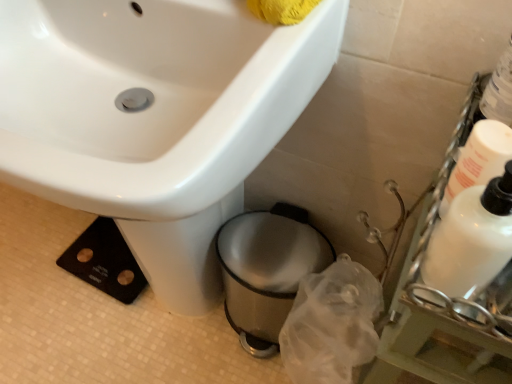
Locate an element on the screen. white glossy bottle at right, the 1th cleaning product when ordered from left to right is located at coordinates (471, 239).

In order to face shiny metallic trash can at lower center, should I rotate leftwards or rightwards?

Rotate right and turn 3.089 degrees.

What is the approximate width of shiny metallic trash can at lower center?

shiny metallic trash can at lower center is 10.18 inches wide.

I want to click on white glossy bottle at right, the 1th cleaning product when ordered from right to left, so click(479, 159).

You are a GUI agent. You are given a task and a screenshot of the screen. Output one action in this format:
    pyautogui.click(x=<x>, y=<y>)
    Task: Click on the white glossy bottle at right, the 1th cleaning product when ordered from left to right
    The image size is (512, 384).
    Given the screenshot: What is the action you would take?
    pyautogui.click(x=471, y=239)

Between white glossy bottle at right, the second cleaning product viewed from the left, and white glossy bottle at right, the 1th cleaning product when ordered from left to right, which one has more height?

With more height is white glossy bottle at right, the 1th cleaning product when ordered from left to right.

From a real-world perspective, is white glossy bottle at right, the 1th cleaning product when ordered from right to left, over white glossy bottle at right, the 1th cleaning product when ordered from left to right?

No.

Considering the positions of objects white glossy bottle at right, the second cleaning product viewed from the left, and white glossy bottle at right, acting as the 2th cleaning product starting from the right, in the image provided, who is behind, white glossy bottle at right, the second cleaning product viewed from the left, or white glossy bottle at right, acting as the 2th cleaning product starting from the right,?

Positioned behind is white glossy bottle at right, the second cleaning product viewed from the left.

Which is in front, point (447, 199) or point (470, 243)?

Positioned in front is point (470, 243).

What's the angular difference between white glossy bottle at right, acting as the 2th cleaning product starting from the right, and shiny metallic trash can at lower center's facing directions?

They differ by 95.4 degrees in their facing directions.

From the picture: Is white glossy bottle at right, acting as the 2th cleaning product starting from the right, not inside shiny metallic trash can at lower center?

Yes, white glossy bottle at right, acting as the 2th cleaning product starting from the right, is outside of shiny metallic trash can at lower center.

Is white glossy bottle at right, the 1th cleaning product when ordered from left to right, turned away from shiny metallic trash can at lower center?

No, white glossy bottle at right, the 1th cleaning product when ordered from left to right, is not facing away from shiny metallic trash can at lower center.

Is shiny metallic trash can at lower center in front of or behind white glossy bottle at right, the 1th cleaning product when ordered from right to left, in the image?

Visually, shiny metallic trash can at lower center is located behind white glossy bottle at right, the 1th cleaning product when ordered from right to left.

Considering the relative positions of shiny metallic trash can at lower center and white glossy bottle at right, the second cleaning product viewed from the left, in the image provided, is shiny metallic trash can at lower center to the left of white glossy bottle at right, the second cleaning product viewed from the left, from the viewer's perspective?

Yes.

From the image's perspective, which is below, shiny metallic trash can at lower center or white glossy bottle at right, the 1th cleaning product when ordered from right to left?

shiny metallic trash can at lower center appears lower in the image.

Considering the sizes of objects shiny metallic trash can at lower center and white glossy bottle at right, the 1th cleaning product when ordered from right to left, in the image provided, who is shorter, shiny metallic trash can at lower center or white glossy bottle at right, the 1th cleaning product when ordered from right to left,?

Standing shorter between the two is white glossy bottle at right, the 1th cleaning product when ordered from right to left.

Who is more distant, white glossy sink at upper left or white glossy bottle at right, acting as the 2th cleaning product starting from the right?

white glossy sink at upper left is behind.

Is white glossy sink at upper left spatially inside white glossy bottle at right, acting as the 2th cleaning product starting from the right, or outside of it?

white glossy sink at upper left is spatially situated outside white glossy bottle at right, acting as the 2th cleaning product starting from the right.

From a real-world perspective, does white glossy sink at upper left sit lower than white glossy bottle at right, the 1th cleaning product when ordered from left to right?

Yes, from a real-world perspective, white glossy sink at upper left is beneath white glossy bottle at right, the 1th cleaning product when ordered from left to right.

Is white glossy bottle at right, acting as the 2th cleaning product starting from the right, oriented towards white glossy bottle at right, the 1th cleaning product when ordered from right to left?

No.

Is white glossy bottle at right, the 1th cleaning product when ordered from right to left, located within white glossy bottle at right, acting as the 2th cleaning product starting from the right?

No, white glossy bottle at right, the 1th cleaning product when ordered from right to left, is not surrounded by white glossy bottle at right, acting as the 2th cleaning product starting from the right.

Which object is more forward, white glossy bottle at right, the 1th cleaning product when ordered from left to right, or white glossy bottle at right, the 1th cleaning product when ordered from right to left?

white glossy bottle at right, the 1th cleaning product when ordered from left to right, is more forward.

From the image's perspective, which is above, white glossy bottle at right, the 1th cleaning product when ordered from left to right, or white glossy bottle at right, the 1th cleaning product when ordered from right to left?

white glossy bottle at right, the 1th cleaning product when ordered from right to left, from the image's perspective.

Is white glossy sink at upper left completely or partially inside white glossy bottle at right, the second cleaning product viewed from the left?

No, white glossy sink at upper left is located outside of white glossy bottle at right, the second cleaning product viewed from the left.

Is white glossy bottle at right, the 1th cleaning product when ordered from right to left, thinner than white glossy sink at upper left?

Yes, white glossy bottle at right, the 1th cleaning product when ordered from right to left, is thinner than white glossy sink at upper left.

Does point (472, 133) appear closer or farther from the camera than point (227, 87)?

Point (472, 133) is closer to the camera than point (227, 87).

Which is in front, white glossy sink at upper left or shiny metallic trash can at lower center?

white glossy sink at upper left.

From a real-world perspective, who is located lower, white glossy sink at upper left or shiny metallic trash can at lower center?

shiny metallic trash can at lower center, from a real-world perspective.

Does white glossy sink at upper left have a lesser width compared to shiny metallic trash can at lower center?

No.

Is point (287, 108) more distant than point (275, 211)?

No, it is in front of (275, 211).

I want to click on cleaning product on the right of white glossy bottle at right, acting as the 2th cleaning product starting from the right, so click(479, 159).

Where is `toilet bowl below the white glossy bottle at right, acting as the 2th cleaning product starting from the right (from a real-world perspective)`? This screenshot has height=384, width=512. toilet bowl below the white glossy bottle at right, acting as the 2th cleaning product starting from the right (from a real-world perspective) is located at coordinates (267, 270).

From the image, which object appears to be nearer to white glossy bottle at right, acting as the 2th cleaning product starting from the right, white glossy sink at upper left or white glossy bottle at right, the second cleaning product viewed from the left?

The object closer to white glossy bottle at right, acting as the 2th cleaning product starting from the right, is white glossy bottle at right, the second cleaning product viewed from the left.

When comparing their distances from white glossy bottle at right, the 1th cleaning product when ordered from right to left, does white glossy sink at upper left or white glossy bottle at right, acting as the 2th cleaning product starting from the right, seem closer?

white glossy bottle at right, acting as the 2th cleaning product starting from the right, is closer to white glossy bottle at right, the 1th cleaning product when ordered from right to left.

Considering their positions, is white glossy bottle at right, the second cleaning product viewed from the left, positioned closer to shiny metallic trash can at lower center than white glossy sink at upper left?

The object closer to shiny metallic trash can at lower center is white glossy sink at upper left.

Based on the photo, estimate the real-world distances between objects in this image. Which object is closer to white glossy bottle at right, the 1th cleaning product when ordered from right to left, white glossy sink at upper left or shiny metallic trash can at lower center?

Among the two, white glossy sink at upper left is located nearer to white glossy bottle at right, the 1th cleaning product when ordered from right to left.

Considering their positions, is shiny metallic trash can at lower center positioned further to white glossy sink at upper left than white glossy bottle at right, the second cleaning product viewed from the left?

white glossy bottle at right, the second cleaning product viewed from the left.

Estimate the real-world distances between objects in this image. Which object is further from white glossy sink at upper left, white glossy bottle at right, the second cleaning product viewed from the left, or white glossy bottle at right, acting as the 2th cleaning product starting from the right?

white glossy bottle at right, acting as the 2th cleaning product starting from the right.

From the image, which object appears to be farther from white glossy bottle at right, the 1th cleaning product when ordered from right to left, shiny metallic trash can at lower center or white glossy bottle at right, the 1th cleaning product when ordered from left to right?

shiny metallic trash can at lower center is positioned further to the anchor white glossy bottle at right, the 1th cleaning product when ordered from right to left.

Consider the image. Based on their spatial positions, is white glossy bottle at right, the 1th cleaning product when ordered from left to right, or white glossy sink at upper left closer to white glossy bottle at right, the 1th cleaning product when ordered from right to left?

white glossy bottle at right, the 1th cleaning product when ordered from left to right.

The width and height of the screenshot is (512, 384). In order to click on cleaning product between white glossy bottle at right, the 1th cleaning product when ordered from left to right, and shiny metallic trash can at lower center in the front-back direction in this screenshot , I will do `click(479, 159)`.

Identify the location of cleaning product between white glossy sink at upper left and shiny metallic trash can at lower center along the z-axis. The width and height of the screenshot is (512, 384). (479, 159).

At what (x,y) coordinates should I click in order to perform the action: click on cleaning product between white glossy sink at upper left and white glossy bottle at right, the second cleaning product viewed from the left. Please return your answer as a coordinate pair (x, y). This screenshot has width=512, height=384. Looking at the image, I should click on (471, 239).

Identify the location of sink between white glossy bottle at right, acting as the 2th cleaning product starting from the right, and shiny metallic trash can at lower center from front to back. The image size is (512, 384). (155, 118).